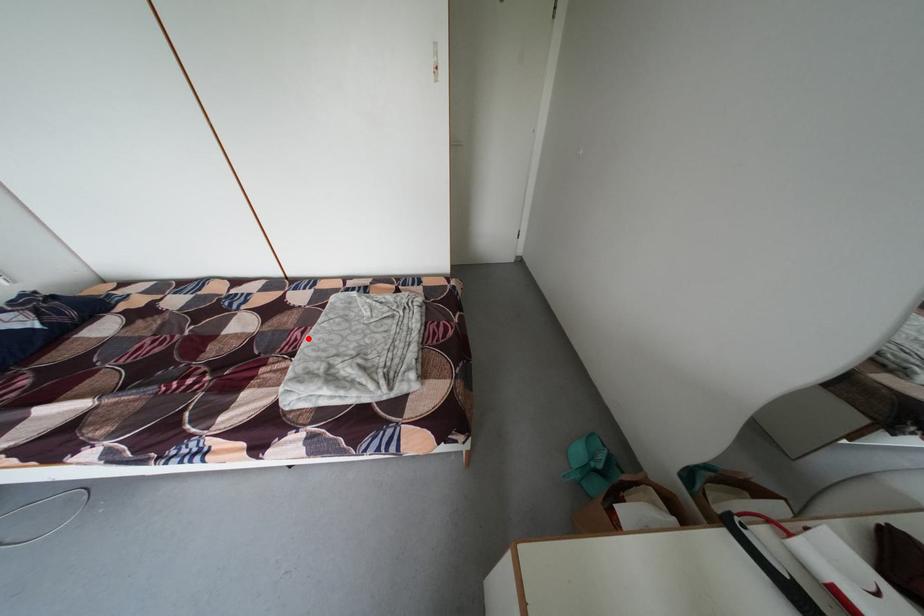
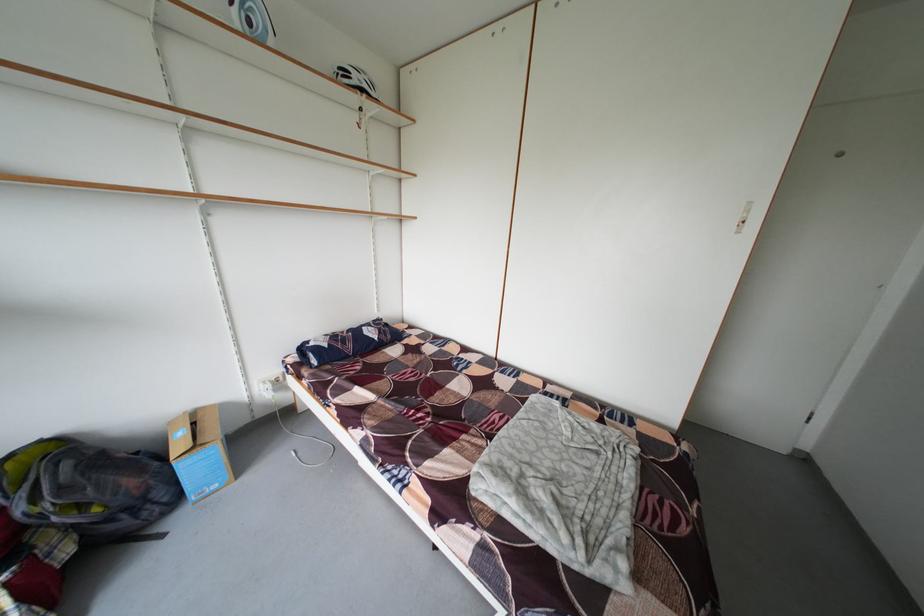
In the second image, find the point that corresponds to the highlighted location in the first image.

(506, 422)